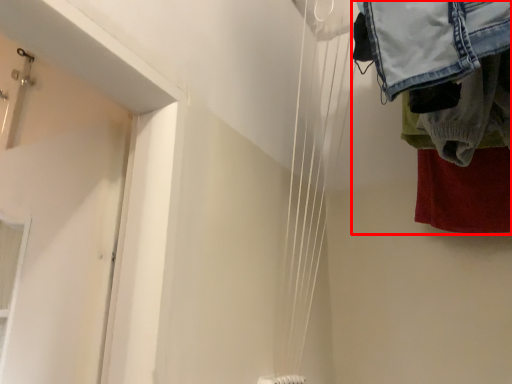
Question: Where is laundry (annotated by the red box) located in relation to wire in the image?

Choices:
 (A) left
 (B) right

Answer: (B)